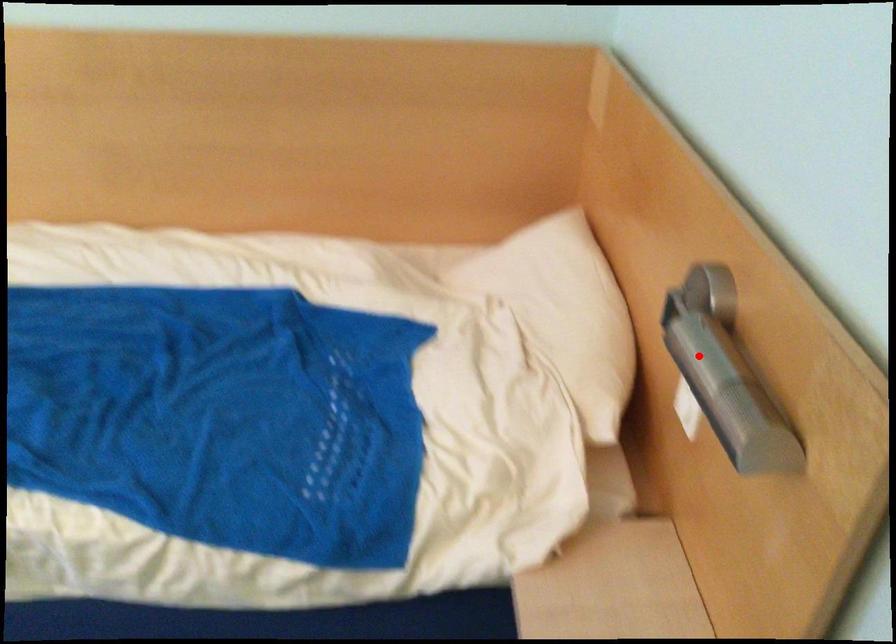
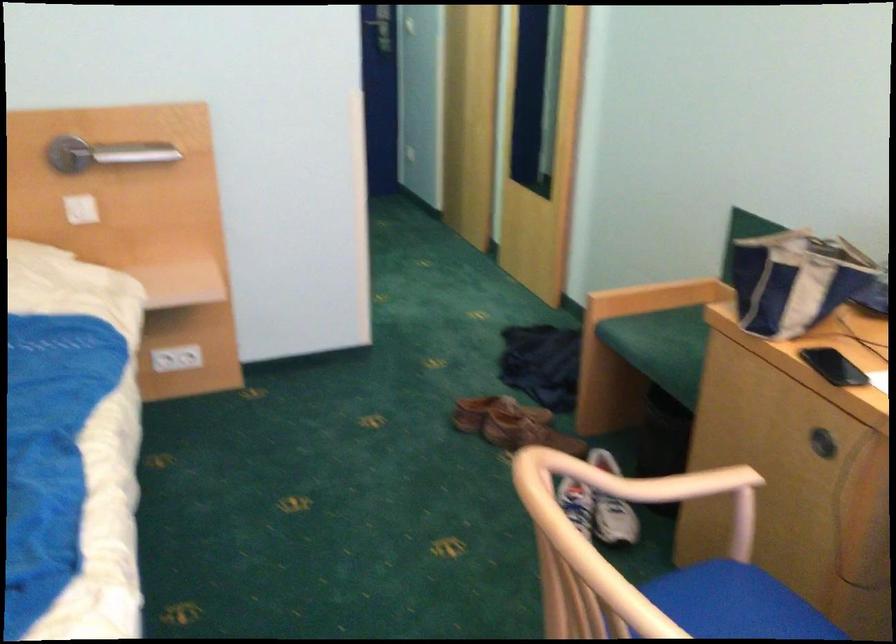
Where in the second image is the point corresponding to the highlighted location from the first image?

(105, 154)